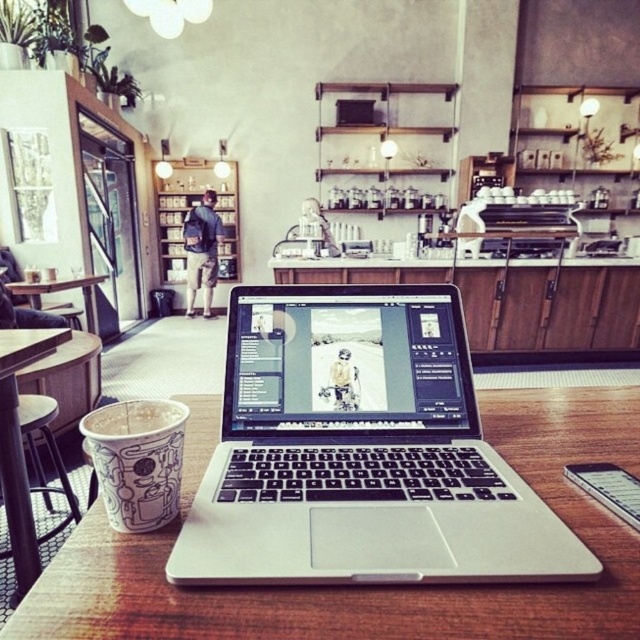
Question: Based on their relative distances, which object is farther from the wooden table at center?

Choices:
 (A) white matte cup at lower left
 (B) white paper cup at center
 (C) silver metallic laptop at center

Answer: (A)

Question: Which of these objects is positioned closest to the white matte cup at lower left?

Choices:
 (A) white paper cup at center
 (B) silver metallic laptop at center

Answer: (A)

Question: Does wooden table at center appear on the left side of white matte cup at lower left?

Choices:
 (A) no
 (B) yes

Answer: (A)

Question: Estimate the real-world distances between objects in this image. Which object is closer to the wooden table at center?

Choices:
 (A) white paper cup at center
 (B) silver metallic laptop at center

Answer: (B)

Question: Is wooden table at center above white matte cup at lower left?

Choices:
 (A) no
 (B) yes

Answer: (A)

Question: Can you confirm if wooden table at center is positioned to the left of white paper cup at center?

Choices:
 (A) yes
 (B) no

Answer: (B)